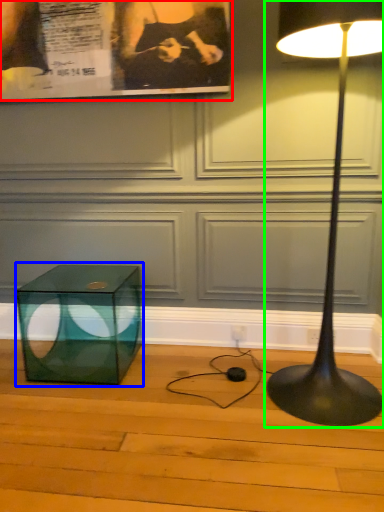
Question: Estimate the real-world distances between objects in this image. Which object is farther from poster page (highlighted by a red box), table (highlighted by a blue box) or lamp (highlighted by a green box)?

Choices:
 (A) table
 (B) lamp

Answer: (A)